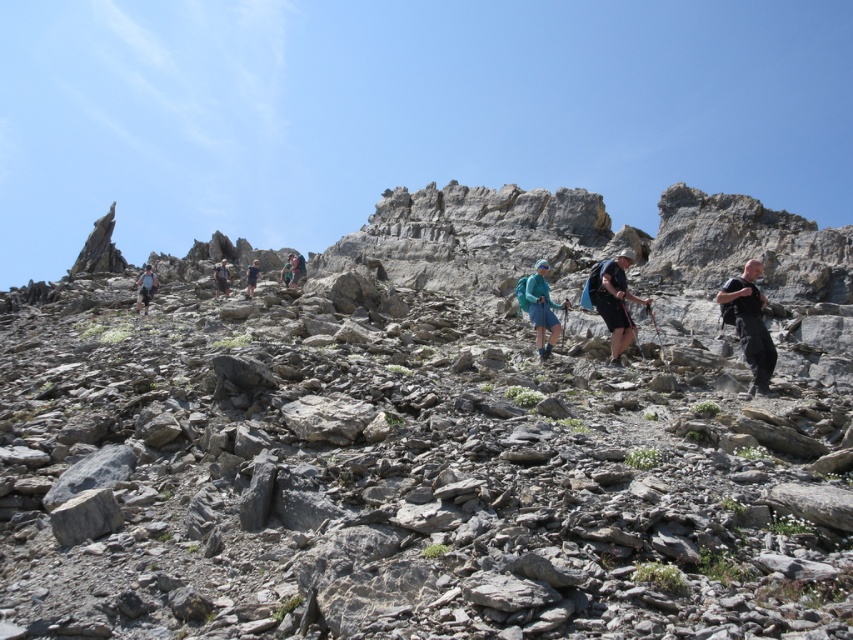
Question: Which point is closer to the camera?

Choices:
 (A) (154, 288)
 (B) (251, 291)

Answer: (A)

Question: Does dark blue fabric backpack at upper center have a lesser width compared to green fabric backpack at center?

Choices:
 (A) yes
 (B) no

Answer: (A)

Question: Does light blue fabric backpack at left appear under blue fabric backpack at upper center?

Choices:
 (A) no
 (B) yes

Answer: (B)

Question: Which of the following is the closest to the observer?

Choices:
 (A) (532, 314)
 (B) (138, 307)
 (C) (213, 268)
 (D) (627, 323)

Answer: (D)

Question: Which object is closer to the camera taking this photo?

Choices:
 (A) light blue fabric backpack at left
 (B) green fabric backpack at center
 (C) dark blue fabric backpack at upper center
 (D) blue fabric backpack at upper center

Answer: (A)

Question: Does dark blue fabric backpack at center have a greater width compared to light blue fabric backpack at left?

Choices:
 (A) yes
 (B) no

Answer: (B)